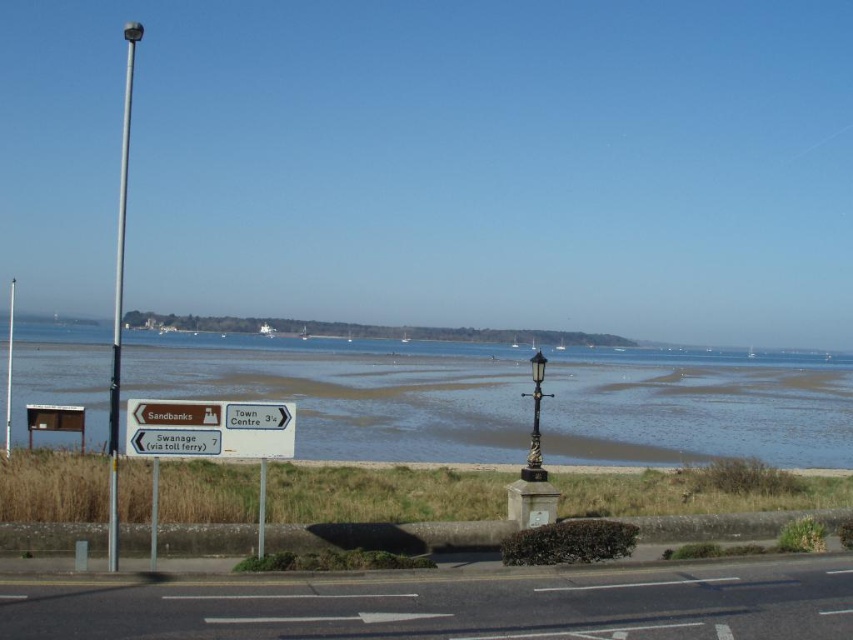
Question: Which of the following is the farthest from the observer?

Choices:
 (A) brown wooden sign at left
 (B) brown sand at lower center

Answer: (B)

Question: Is brown sand at lower center thinner than brushed metal pole at center?

Choices:
 (A) no
 (B) yes

Answer: (A)

Question: Estimate the real-world distances between objects in this image. Which object is closer to the silver metallic pole at left?

Choices:
 (A) white plastic sign at lower center
 (B) brown sand at lower center
 (C) metallic pole at left

Answer: (A)

Question: Does brown wooden sign at left have a larger size compared to polished brass lamp post at center?

Choices:
 (A) no
 (B) yes

Answer: (A)

Question: Does brown wooden sign at left have a larger size compared to metallic pole at left?

Choices:
 (A) yes
 (B) no

Answer: (B)

Question: Among these objects, which one is farthest from the camera?

Choices:
 (A) brown wooden sign at left
 (B) white plastic sign at lower center
 (C) metallic pole at left
 (D) polished brass lamp post at center

Answer: (C)